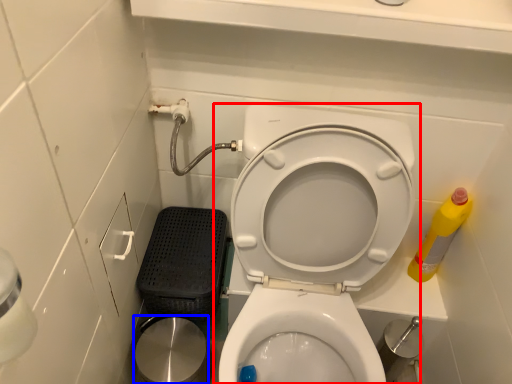
Question: Which of the following is the farthest to the observer, toilet (highlighted by a red box) or potty (highlighted by a blue box)?

Choices:
 (A) toilet
 (B) potty

Answer: (B)